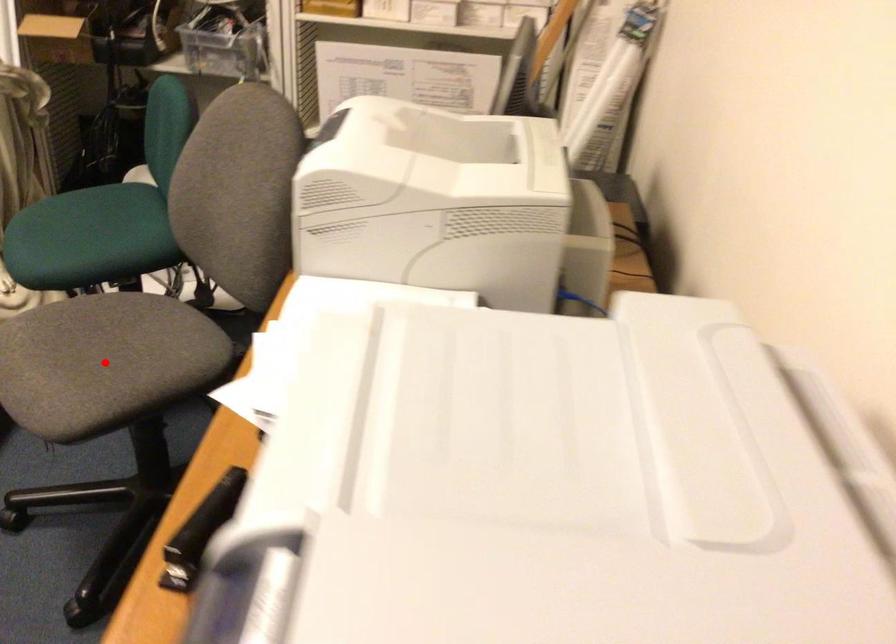
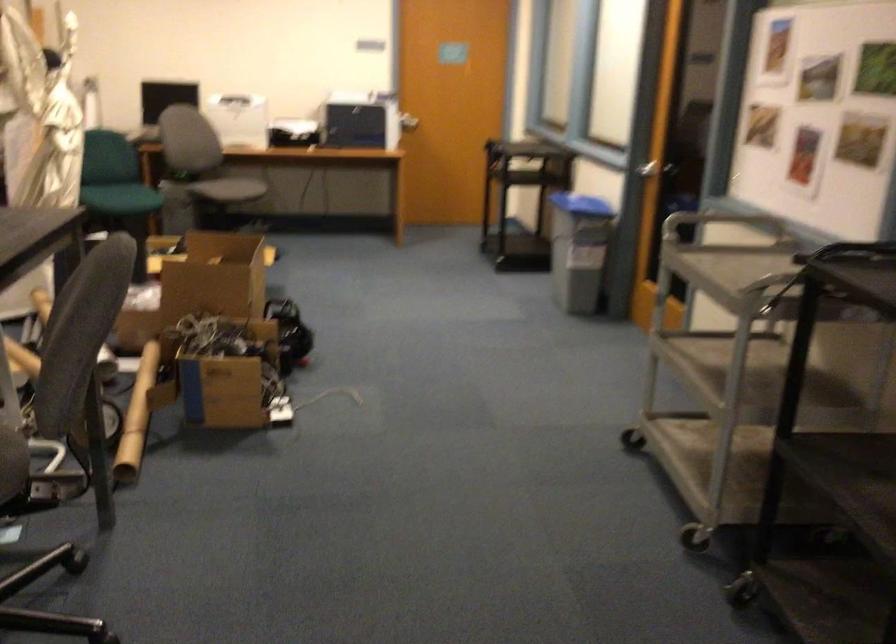
Question: I am providing you with two images of the same scene from different viewpoints. A red point is marked on the first image. Can you still see the location of the red point in image 2?

Choices:
 (A) Yes
 (B) No

Answer: (B)